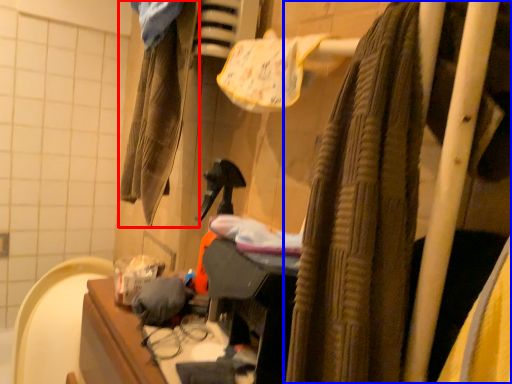
Question: Which object appears farthest to the camera in this image, clothing (highlighted by a red box) or curtain (highlighted by a blue box)?

Choices:
 (A) clothing
 (B) curtain

Answer: (A)